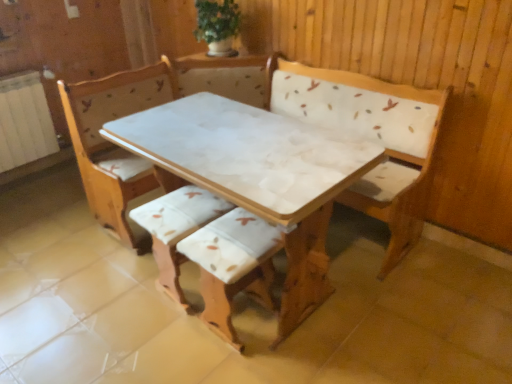
Locate an element on the screen. This screenshot has height=384, width=512. vacant space situated on the left part of white fabric cushion at center, which is the 2th armchair from right to left is located at coordinates pos(125,291).